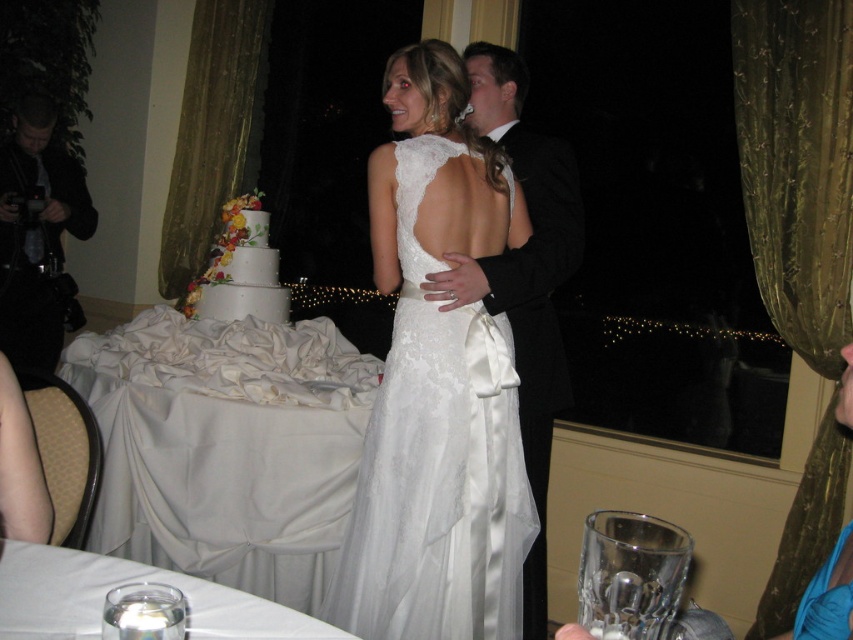
Question: Is lace fabric dress at center to the left of white textured cake at left from the viewer's perspective?

Choices:
 (A) no
 (B) yes

Answer: (A)

Question: Among these points, which one is nearest to the camera?

Choices:
 (A) (227, 304)
 (B) (486, 490)

Answer: (B)

Question: Is black satin tuxedo at right smaller than white textured cake at left?

Choices:
 (A) no
 (B) yes

Answer: (A)

Question: Estimate the real-world distances between objects in this image. Which object is farther from the lace fabric dress at center?

Choices:
 (A) white textured cake at left
 (B) black satin tuxedo at right

Answer: (A)

Question: Is black satin tuxedo at right below white textured cake at left?

Choices:
 (A) yes
 (B) no

Answer: (A)

Question: Among these points, which one is nearest to the camera?

Choices:
 (A) (254, 298)
 (B) (399, 426)

Answer: (B)